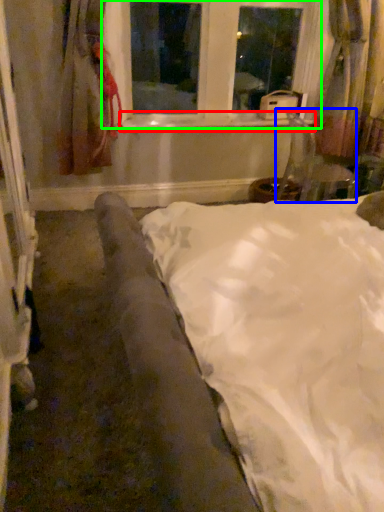
Question: Estimate the real-world distances between objects in this image. Which object is farther from window sill (highlighted by a red box), armchair (highlighted by a blue box) or window (highlighted by a green box)?

Choices:
 (A) armchair
 (B) window

Answer: (A)